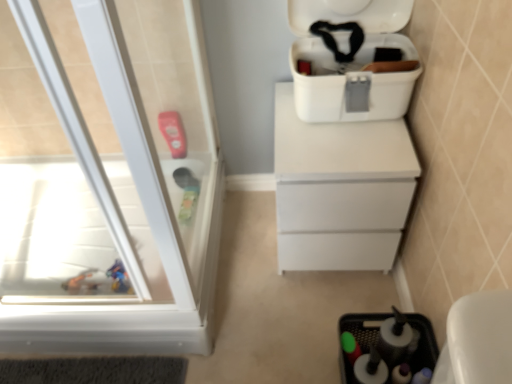
Question: Is transparent plastic screen door at left located within white matte chest of drawers at center?

Choices:
 (A) no
 (B) yes

Answer: (A)

Question: Considering the relative sizes of white matte chest of drawers at center and transparent plastic screen door at left in the image provided, is white matte chest of drawers at center shorter than transparent plastic screen door at left?

Choices:
 (A) no
 (B) yes

Answer: (B)

Question: Is white matte chest of drawers at center at the right side of transparent plastic screen door at left?

Choices:
 (A) no
 (B) yes

Answer: (B)

Question: From the image's perspective, does white matte chest of drawers at center appear lower than transparent plastic screen door at left?

Choices:
 (A) yes
 (B) no

Answer: (A)

Question: Can you confirm if white matte chest of drawers at center is wider than transparent plastic screen door at left?

Choices:
 (A) no
 (B) yes

Answer: (B)

Question: Is white matte chest of drawers at center located outside transparent plastic screen door at left?

Choices:
 (A) yes
 (B) no

Answer: (A)

Question: Is black plastic sink at lower right at the back of white plastic cooler at upper right?

Choices:
 (A) no
 (B) yes

Answer: (A)

Question: Is white plastic cooler at upper right smaller than black plastic sink at lower right?

Choices:
 (A) yes
 (B) no

Answer: (B)

Question: Considering the relative sizes of white plastic cooler at upper right and black plastic sink at lower right in the image provided, is white plastic cooler at upper right shorter than black plastic sink at lower right?

Choices:
 (A) yes
 (B) no

Answer: (B)

Question: Is white plastic cooler at upper right positioned in front of black plastic sink at lower right?

Choices:
 (A) yes
 (B) no

Answer: (A)

Question: Is white plastic cooler at upper right oriented towards black plastic sink at lower right?

Choices:
 (A) no
 (B) yes

Answer: (A)

Question: Is white plastic cooler at upper right placed right next to black plastic sink at lower right?

Choices:
 (A) no
 (B) yes

Answer: (A)

Question: Would you consider black plastic sink at lower right to be distant from white plastic cooler at upper right?

Choices:
 (A) no
 (B) yes

Answer: (A)